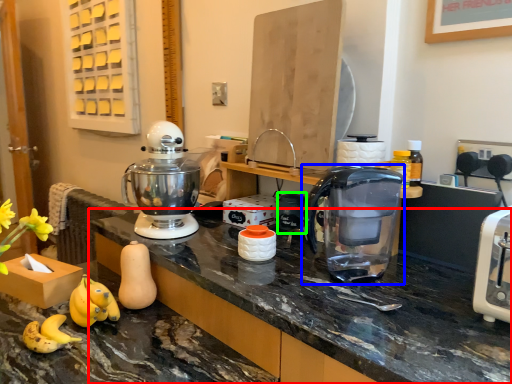
Question: Which is farther away from countertop (highlighted by a red box)? coffeepot (highlighted by a blue box) or appliance (highlighted by a green box)?

Choices:
 (A) coffeepot
 (B) appliance

Answer: (B)